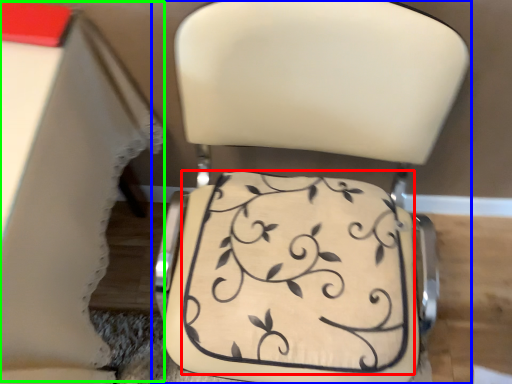
Question: Which object is positioned closest to wedding cake (highlighted by a red box)? Select from chair (highlighted by a blue box) and table (highlighted by a green box).

Choices:
 (A) chair
 (B) table

Answer: (A)